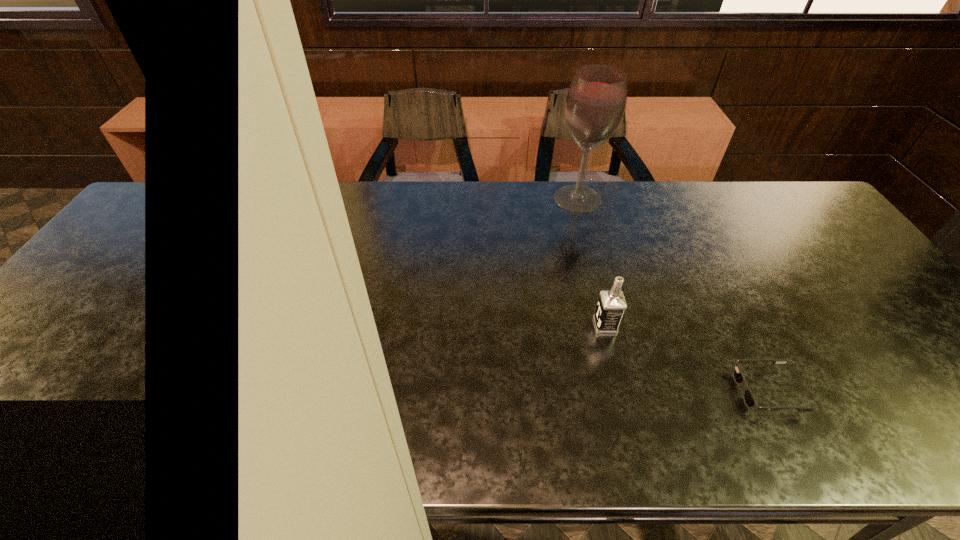
Locate an element on the screen. This screenshot has height=540, width=960. alcohol is located at coordinates (596, 100).

I want to click on the farthest object, so click(596, 100).

This screenshot has height=540, width=960. Identify the location of the second farthest object. (611, 305).

The image size is (960, 540). In order to click on vodka in this screenshot , I will do `click(611, 305)`.

At what (x,y) coordinates should I click in order to perform the action: click on the nearest object. Please return your answer as a coordinate pair (x, y). The height and width of the screenshot is (540, 960). Looking at the image, I should click on (738, 376).

The width and height of the screenshot is (960, 540). What are the coordinates of `the rightmost object` in the screenshot? It's located at (738, 376).

At what (x,y) coordinates should I click in order to perform the action: click on vacant space located on the left of the alcohol. Please return your answer as a coordinate pair (x, y). The height and width of the screenshot is (540, 960). Looking at the image, I should click on (463, 199).

Where is `free spot located 0.290m on the front label of the second tallest object`? This screenshot has height=540, width=960. free spot located 0.290m on the front label of the second tallest object is located at coordinates (478, 326).

Where is `free space located 0.300m on the front label of the second tallest object`? The width and height of the screenshot is (960, 540). free space located 0.300m on the front label of the second tallest object is located at coordinates (474, 326).

The image size is (960, 540). What are the coordinates of `blank space located on the front label of the second tallest object` in the screenshot? It's located at (478, 326).